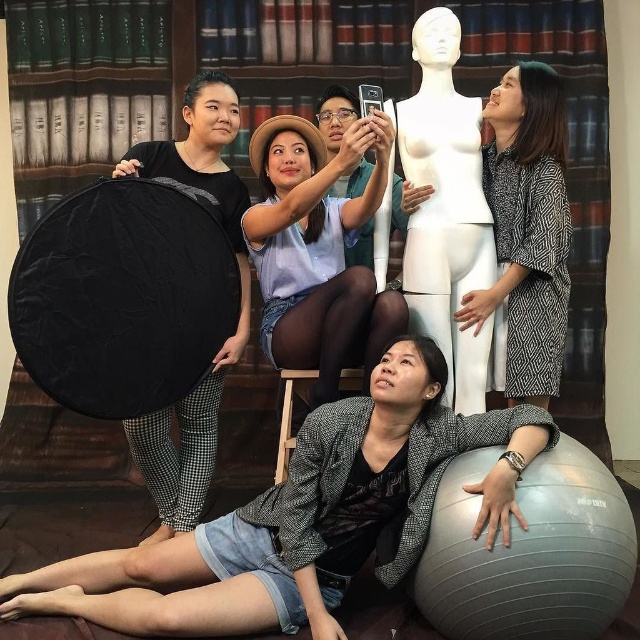
You are standing in front of the photo and want to locate the matte blue shirt at upper center. According to the coordinates, where exactly is it positioned?

The matte blue shirt at upper center is positioned at the 2D coordinates point (321,256).

You are a photographer trying to capture a closeup shot of the white matte mannequin at center and the patterned fabric kimono at right. Your camera has a maximum focus range of 7 inches. Can you fit both objects within the camera frame without moving them?

The distance between the white matte mannequin at center and the patterned fabric kimono at right is 7.36 inches, which exceeds the camera maximum focus range of 7 inches. Therefore, you cannot fit both objects within the camera frame without moving them.